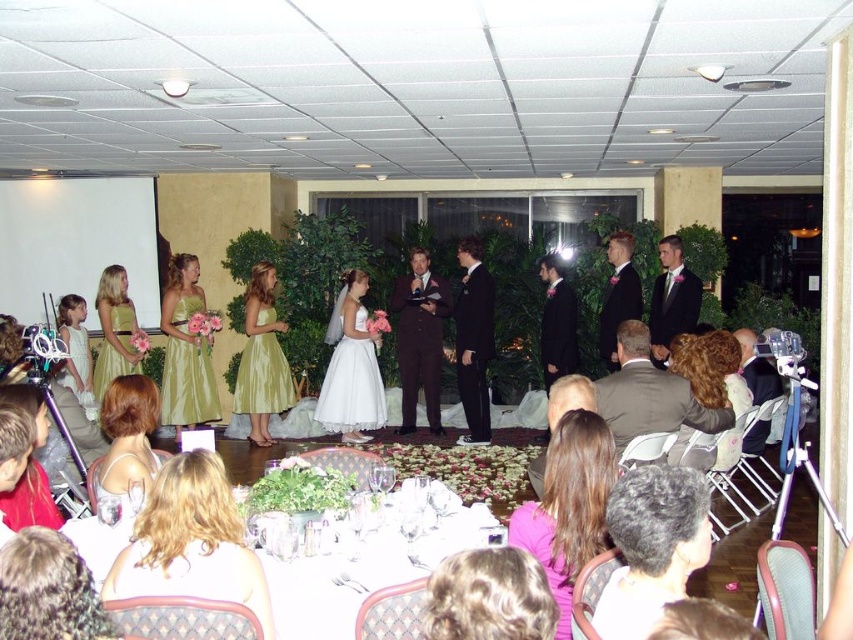
Question: Considering the real-world distances, which object is closest to the satin gold dress at lower left?

Choices:
 (A) matte black suit at center
 (B) white glossy table at center
 (C) dark suit at center

Answer: (B)

Question: Can you confirm if matte green dress at center is positioned below black satin suit at center?

Choices:
 (A) yes
 (B) no

Answer: (A)

Question: Can you confirm if pink fabric hair at center is positioned to the left of dark gray suit at center?

Choices:
 (A) no
 (B) yes

Answer: (B)

Question: Can you confirm if matte gray suit at center is positioned to the right of black satin suit at center?

Choices:
 (A) no
 (B) yes

Answer: (B)

Question: Which object appears closest to the camera in this image?

Choices:
 (A) white satin dress at center
 (B) satin gold dress at lower left
 (C) pink fabric hair at center

Answer: (C)

Question: Which point is farther to the camera?

Choices:
 (A) black satin suit at center
 (B) shiny gold dress at center

Answer: (A)